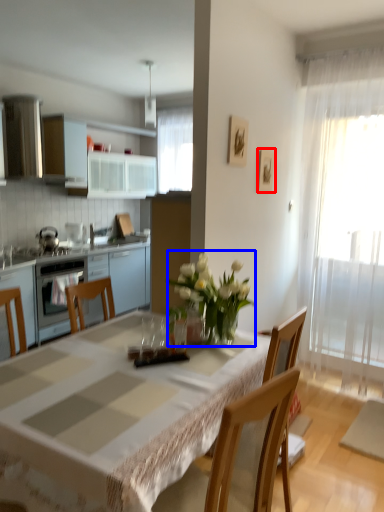
Question: Which of the following is the closest to the observer, picture frame (highlighted by a red box) or floral arrangement (highlighted by a blue box)?

Choices:
 (A) picture frame
 (B) floral arrangement

Answer: (B)